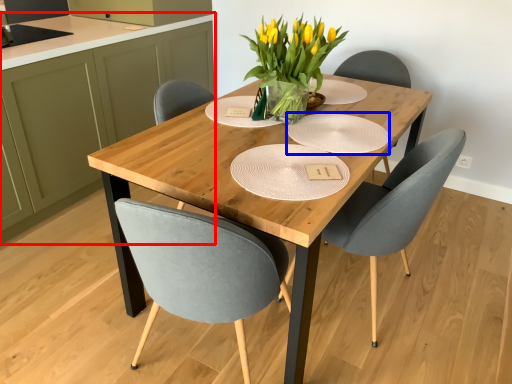
Question: Which object is closer to the camera taking this photo, cabinetry (highlighted by a red box) or paper plate (highlighted by a blue box)?

Choices:
 (A) cabinetry
 (B) paper plate

Answer: (B)